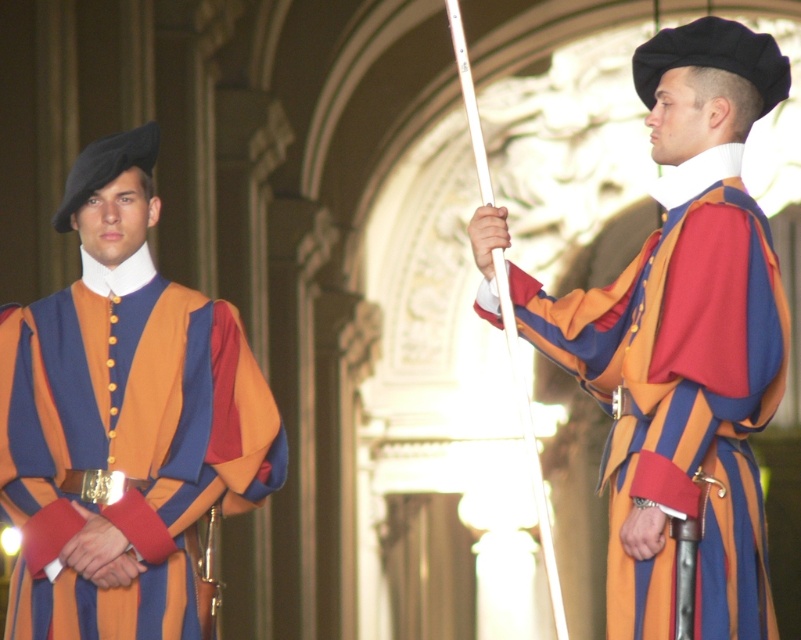
You are an observer standing in front of the two individuals. Which object, the matte striped robe at center or the matte black beret at left, is covering part of the other?

The matte striped robe at center is positioned over the matte black beret at left, so the matte striped robe at center is covering part of the matte black beret at left.

In the historical setting, there is a matte striped robe at center and a matte black beret at left. Which object is taller?

The matte striped robe at center is taller than the matte black beret at left according to the description.

You are a photographer trying to capture a group photo of the two people in the image. The matte striped robe at center is worn by one of them. Given that the two individuals are 181.44 feet apart, will you need to use a telephoto lens to ensure both are in focus and clear?

The two individuals are 181.44 feet apart, so yes, you will need to use a telephoto lens to ensure both are in focus and clear.